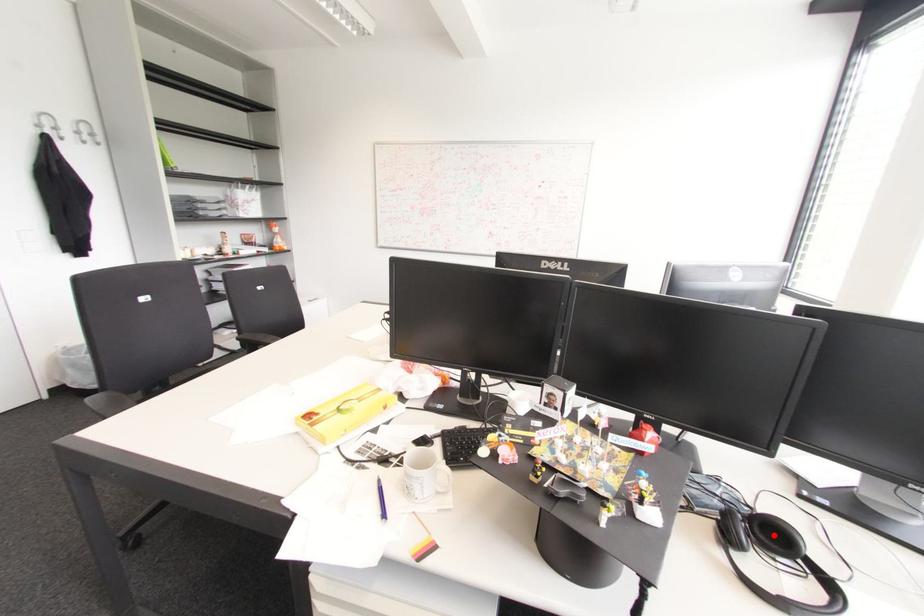
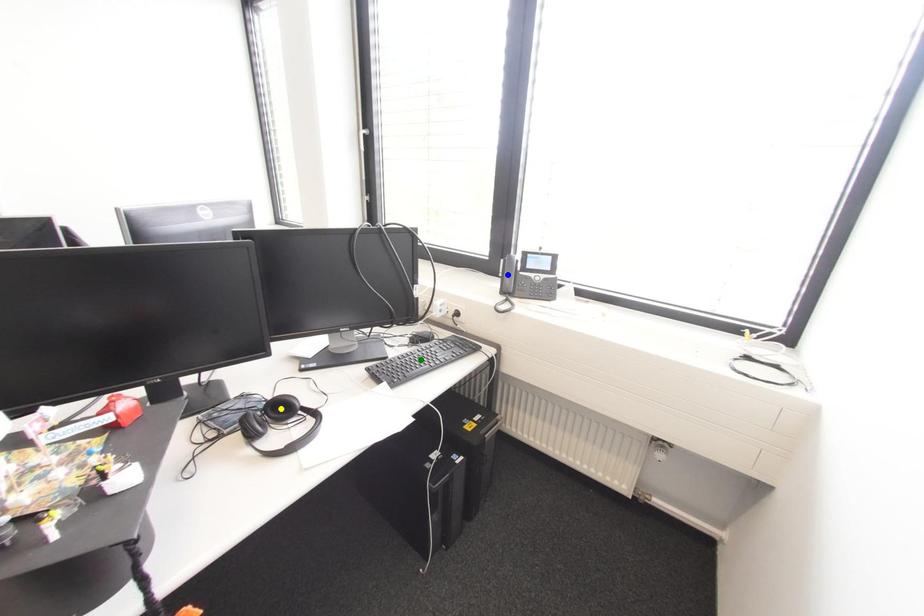
Question: I am providing you with two images of the same scene from different viewpoints. A red point is marked on the first image. You are given multiple points on the second image. In image 2, which mark is for the same physical point as the one in image 1?

Choices:
 (A) green point
 (B) blue point
 (C) yellow point

Answer: (C)